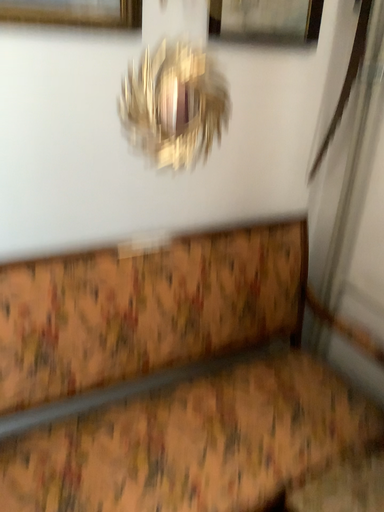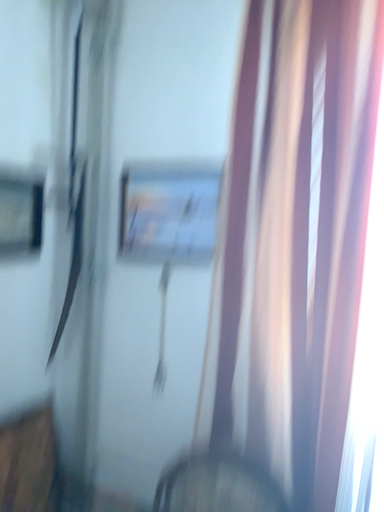
Question: Which way did the camera rotate in the video?

Choices:
 (A) rotated left
 (B) rotated right

Answer: (B)